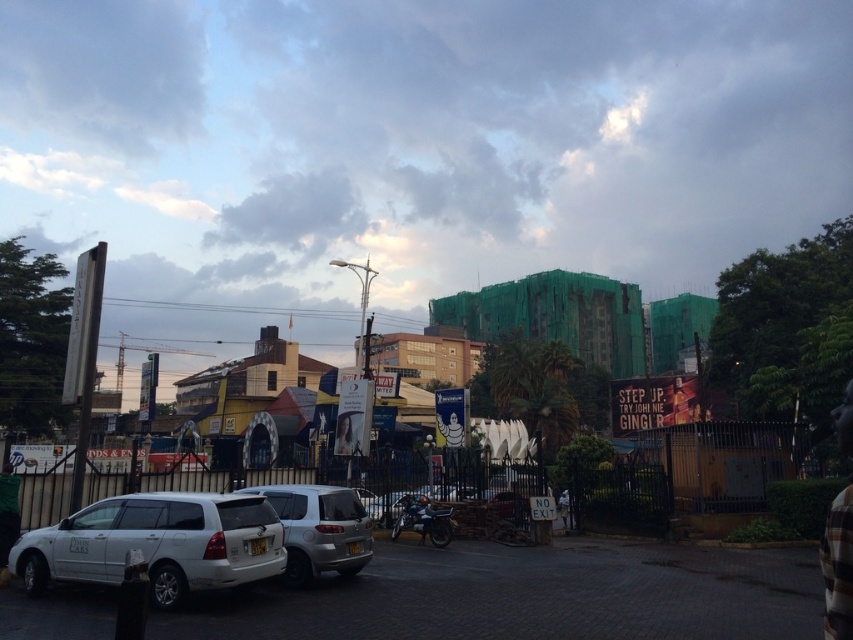
Between white matte van at lower left and satin silver suv at center, which one appears on the left side from the viewer's perspective?

white matte van at lower left is more to the left.

Can you confirm if white matte van at lower left is positioned below satin silver suv at center?

Yes, white matte van at lower left is below satin silver suv at center.

At what (x,y) coordinates should I click in order to perform the action: click on white matte van at lower left. Please return your answer as a coordinate pair (x, y). The image size is (853, 640). Looking at the image, I should click on (157, 544).